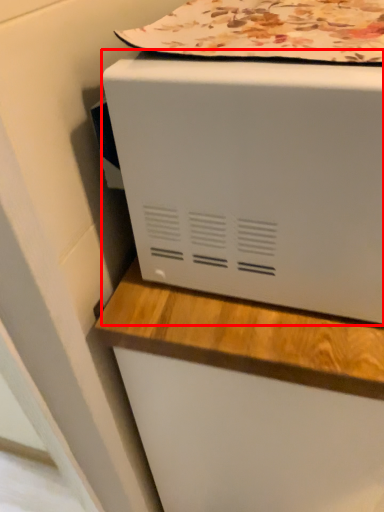
Question: Considering the relative positions of home appliance (annotated by the red box) and blanket in the image provided, where is home appliance (annotated by the red box) located with respect to the staircase?

Choices:
 (A) left
 (B) right

Answer: (B)